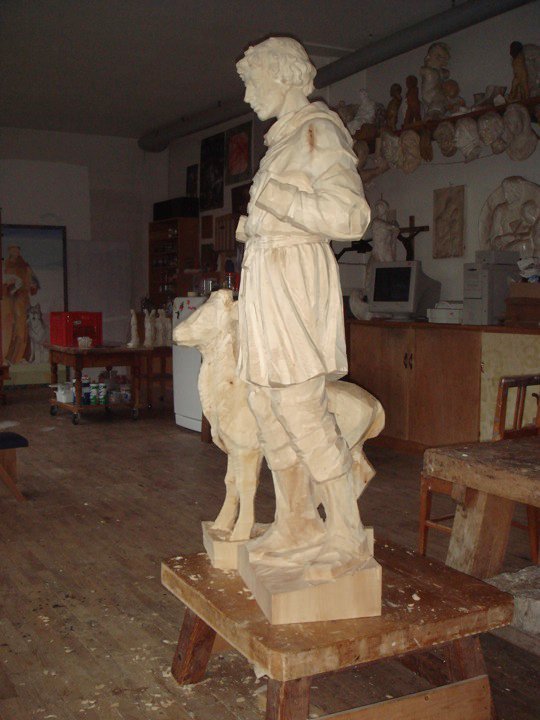
Find the location of `computer tower`. computer tower is located at coordinates (478, 284).